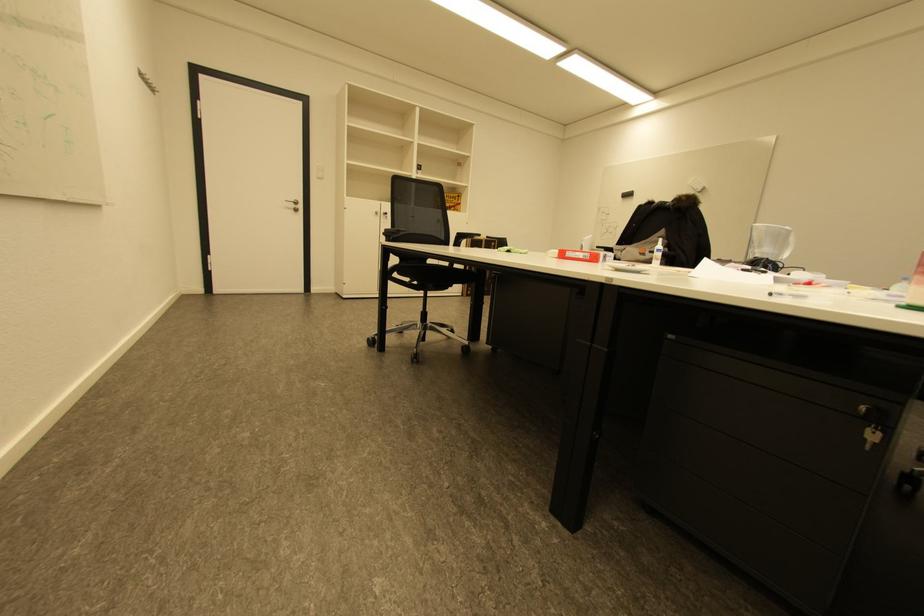
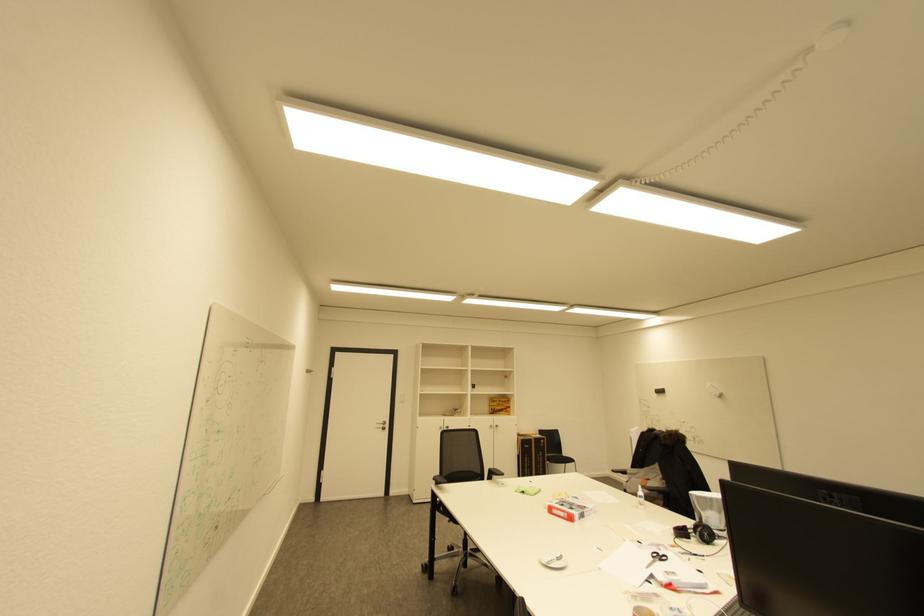
Locate, in the second image, the point that corresponds to (295,209) in the first image.

(385, 429)